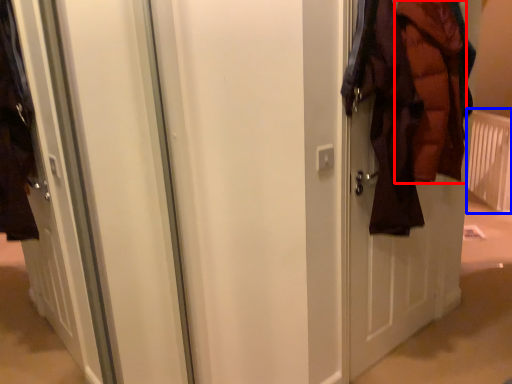
Question: Which object appears farthest to the camera in this image, garment (highlighted by a red box) or radiator (highlighted by a blue box)?

Choices:
 (A) garment
 (B) radiator

Answer: (B)